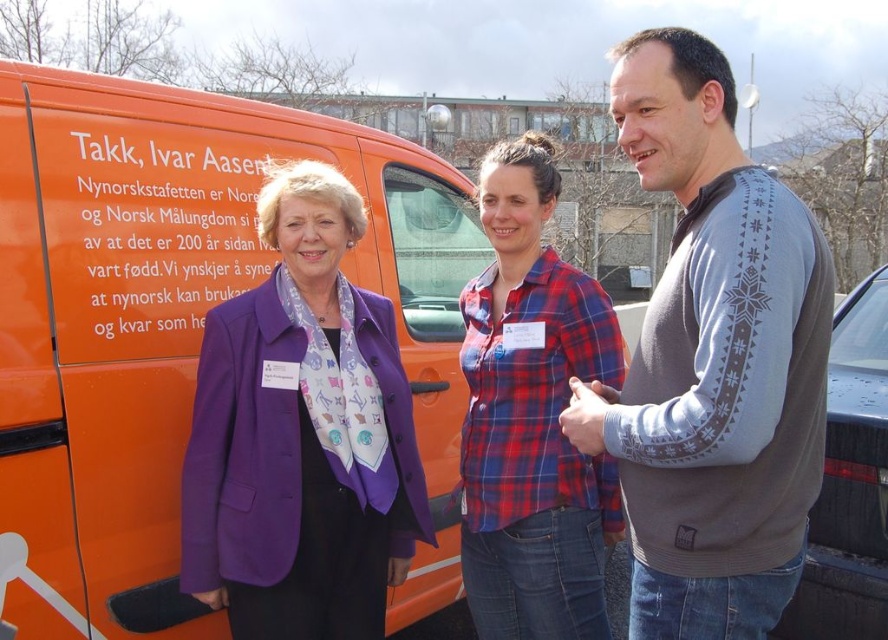
Question: Estimate the real-world distances between objects in this image. Which object is farther from the plaid fabric shirt at center?

Choices:
 (A) orange matte van at center
 (B) gray sweater at center

Answer: (A)

Question: Does gray sweater at center have a greater width compared to plaid fabric shirt at center?

Choices:
 (A) yes
 (B) no

Answer: (A)

Question: Which object appears farthest from the camera in this image?

Choices:
 (A) gray sweater at center
 (B) purple satin blazer at center
 (C) plaid fabric shirt at center
 (D) orange matte van at center

Answer: (C)

Question: Does purple satin blazer at center appear on the right side of plaid fabric shirt at center?

Choices:
 (A) yes
 (B) no

Answer: (B)

Question: Is orange matte van at center to the right of plaid fabric shirt at center from the viewer's perspective?

Choices:
 (A) no
 (B) yes

Answer: (A)

Question: Among these objects, which one is nearest to the camera?

Choices:
 (A) orange matte van at center
 (B) purple satin blazer at center
 (C) gray sweater at center

Answer: (C)